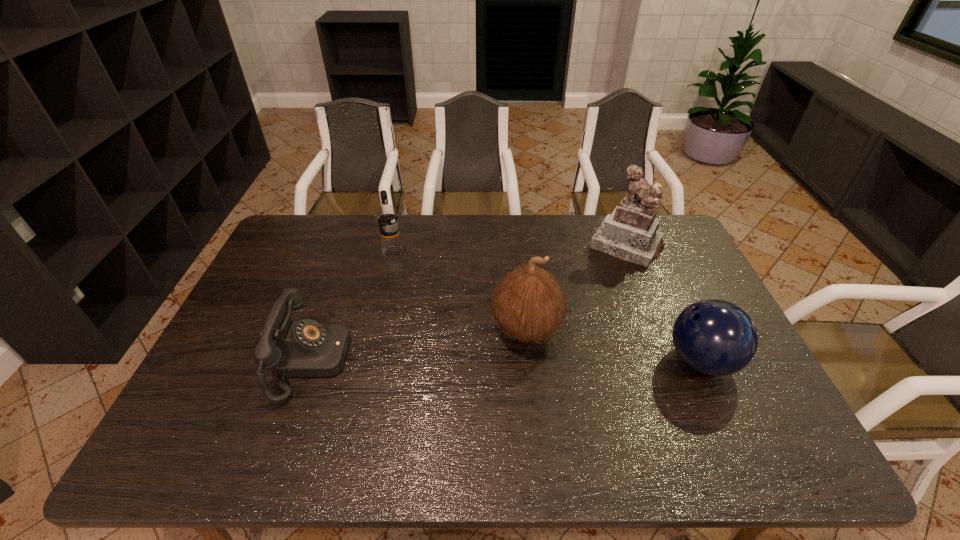
Where is `free region located 0.310m on the surface of the bowling ball near the finger holes`? Image resolution: width=960 pixels, height=540 pixels. free region located 0.310m on the surface of the bowling ball near the finger holes is located at coordinates (549, 361).

You are a GUI agent. You are given a task and a screenshot of the screen. Output one action in this format:
    pyautogui.click(x=<x>, y=<y>)
    Task: Click on the free point located on the surface of the coconut
    This screenshot has width=960, height=540.
    Given the screenshot: What is the action you would take?
    pyautogui.click(x=394, y=391)

I want to click on vacant space located on the surface of the coconut, so click(378, 398).

Where is `free space located 0.230m on the surface of the coconut`? free space located 0.230m on the surface of the coconut is located at coordinates 419,379.

This screenshot has height=540, width=960. I want to click on free space located 0.310m on the label of the second object from left to right, so click(x=448, y=312).

At what (x,y) coordinates should I click in order to perform the action: click on vacant position located 0.230m on the label of the second object from left to right. Please return your answer as a coordinate pair (x, y). This screenshot has height=540, width=960. Looking at the image, I should click on (434, 296).

The height and width of the screenshot is (540, 960). What are the coordinates of `vacant region located on the label of the second object from left to right` in the screenshot? It's located at (459, 324).

The height and width of the screenshot is (540, 960). Find the location of `free space located 0.070m on the front-facing side of the figurine`. free space located 0.070m on the front-facing side of the figurine is located at coordinates (605, 275).

In order to click on vacant space situated on the front-facing side of the figurine in this screenshot , I will do `click(570, 326)`.

Image resolution: width=960 pixels, height=540 pixels. I want to click on vacant space located 0.170m on the front-facing side of the figurine, so click(592, 294).